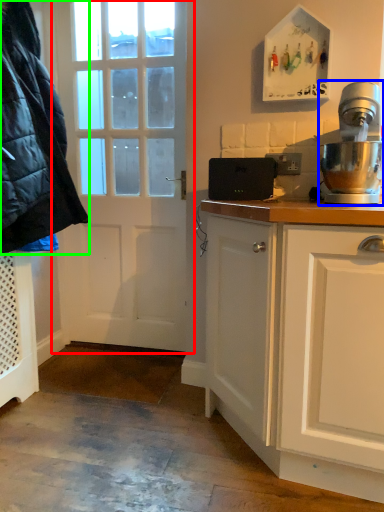
Question: Which object is the closest to the door (highlighted by a red box)? Choose among these: home appliance (highlighted by a blue box) or jacket (highlighted by a green box).

Choices:
 (A) home appliance
 (B) jacket

Answer: (B)